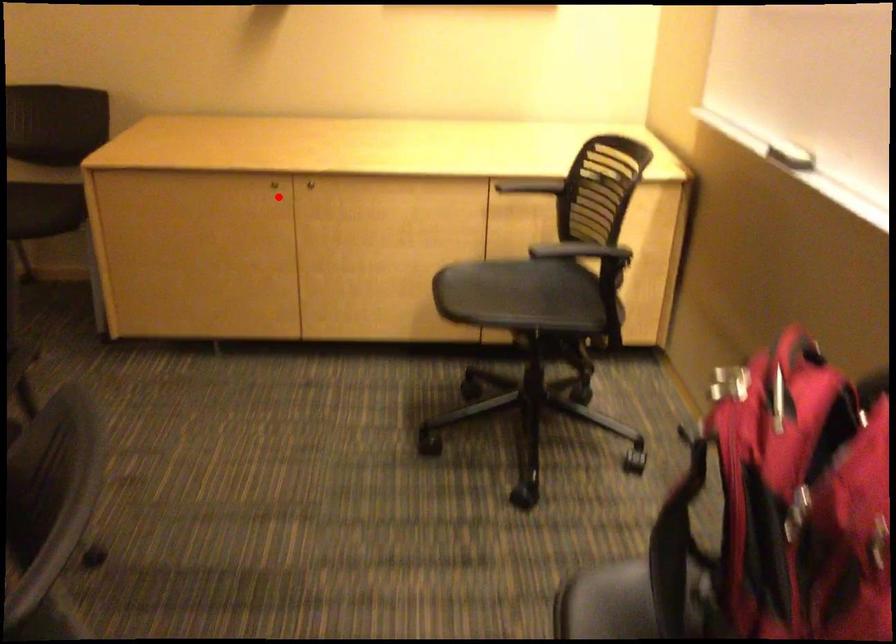
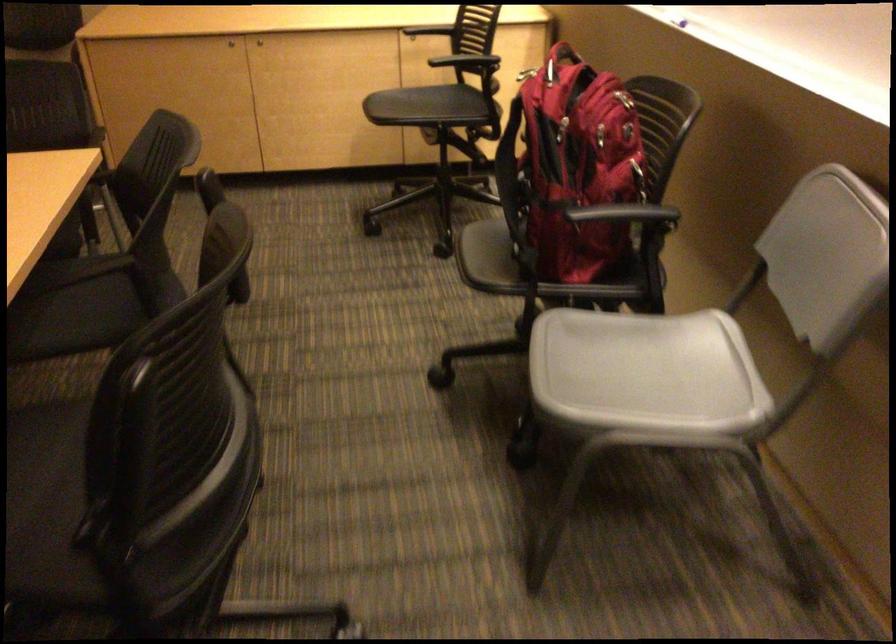
Question: I am providing you with two images of the same scene from different viewpoints. A red point is shown in image1. For the corresponding object point in image2, is it positioned nearer or farther from the camera?

Choices:
 (A) Nearer
 (B) Farther

Answer: (B)